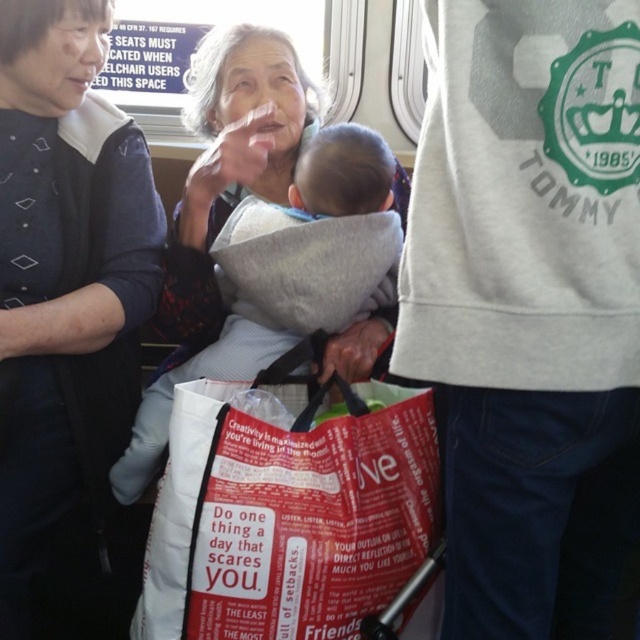
You are a passenger on a train and see the white cotton sweatshirt at center and the red fabric bag at center. Which item is closer to you if you are sitting in the seat directly behind them?

The white cotton sweatshirt at center is closer to you because it is in front of the red fabric bag at center.

You are a passenger on the train and notice a point marked at coordinates (529,305). What object is located at this point?

The point at coordinates (529,305) corresponds to the white cotton sweatshirt at center.